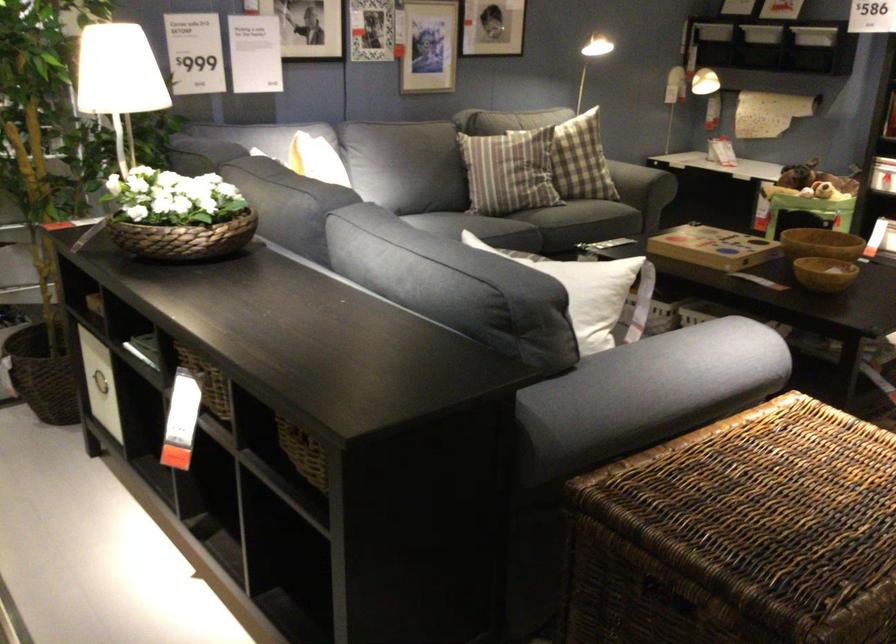
The height and width of the screenshot is (644, 896). Identify the location of woven flower basket. (177, 216).